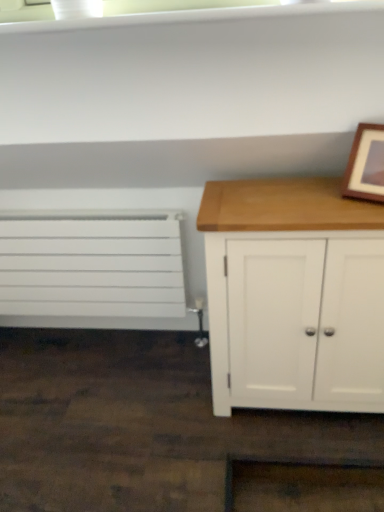
You are a GUI agent. You are given a task and a screenshot of the screen. Output one action in this format:
    pyautogui.click(x=<x>, y=<y>)
    Task: Click on the blank area beneath white matte radiator at left (from a real-world perspective)
    
    Given the screenshot: What is the action you would take?
    pyautogui.click(x=102, y=339)